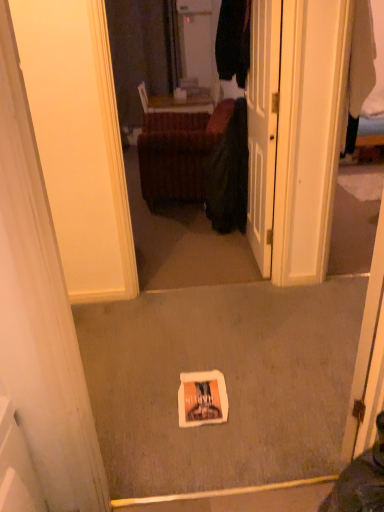
The height and width of the screenshot is (512, 384). Find the location of `vacant region to the left of dark green fabric at center`. vacant region to the left of dark green fabric at center is located at coordinates coord(169,227).